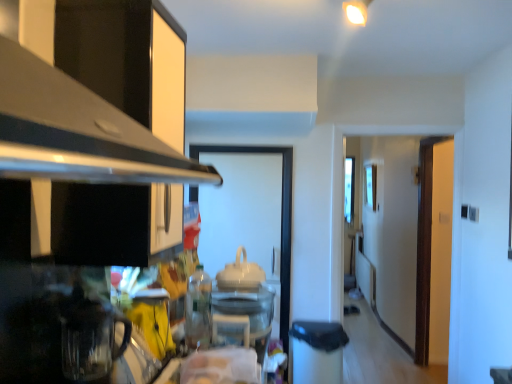
Question: From a real-world perspective, is white glossy teapot at center, which appears as the 4th appliance when viewed from the front, positioned above or below brown wooden door at right?

Choices:
 (A) above
 (B) below

Answer: (A)

Question: In the image, is white glossy teapot at center, positioned as the 1th appliance in back-to-front order, positioned in front of or behind brown wooden door at right?

Choices:
 (A) behind
 (B) front

Answer: (B)

Question: Based on their relative distances, which object is nearer to the brown wooden door at right?

Choices:
 (A) yellow matte mug at lower left, which is the 3th appliance in right-to-left order
 (B) transparent glass coffee pot at lower left, the first appliance viewed from the left
 (C) white glossy teapot at center, positioned as the first appliance in right-to-left order
 (D) black metallic exhaust hood at upper left
 (E) clear plastic bottle at lower center, which is counted as the third appliance, starting from the front

Answer: (C)

Question: Estimate the real-world distances between objects in this image. Which object is farther from the transparent glass door at center?

Choices:
 (A) brown wooden door at right
 (B) yellow matte mug at lower left, placed as the 3th appliance when sorted from back to front
 (C) clear plastic bottle at lower center, which is counted as the third appliance, starting from the front
 (D) white glossy teapot at center, positioned as the first appliance in right-to-left order
 (E) transparent glass coffee pot at lower left, the first appliance viewed from the front

Answer: (E)